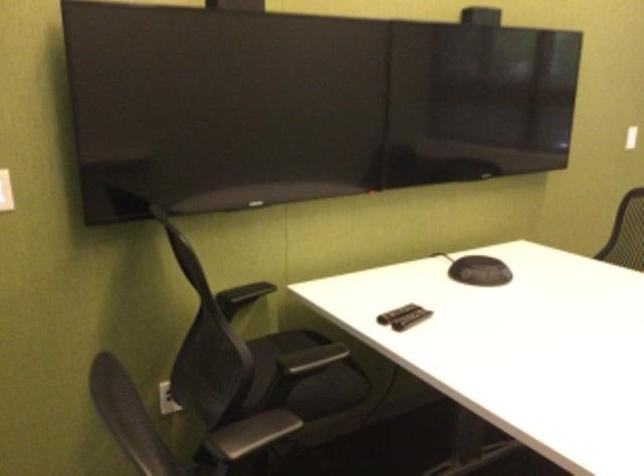
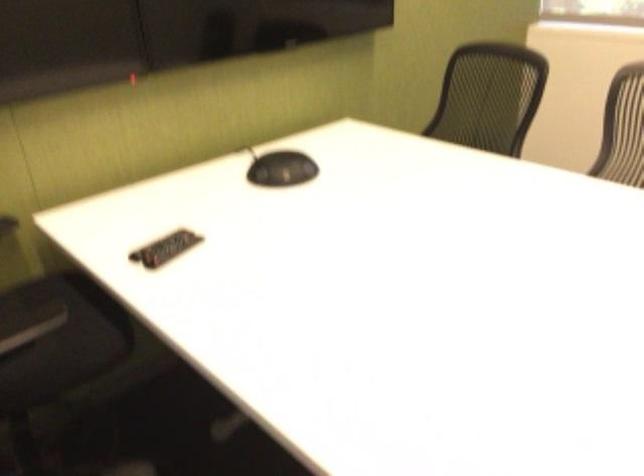
The point at (409,317) is marked in the first image. Where is the corresponding point in the second image?

(165, 248)